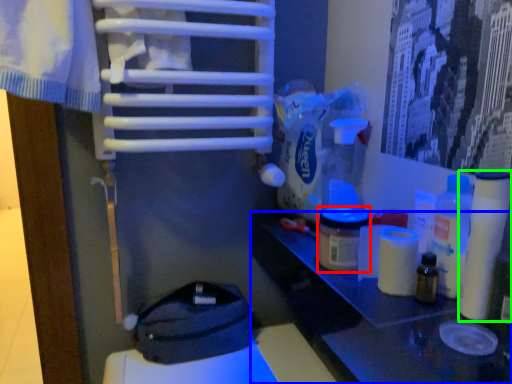
Question: Which object is positioned farthest from product (highlighted by a red box)? Select from table (highlighted by a blue box) and toilet paper (highlighted by a green box).

Choices:
 (A) table
 (B) toilet paper

Answer: (B)